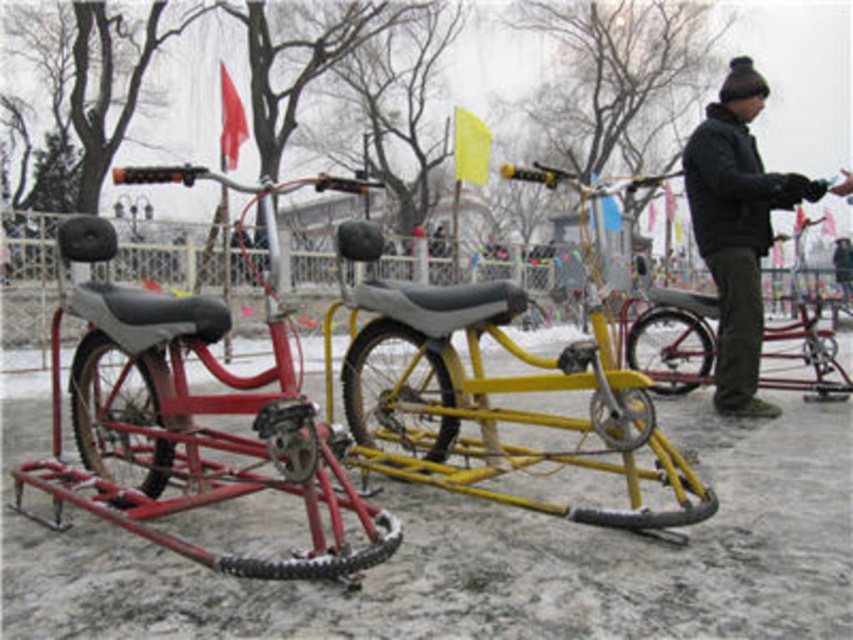
You are planning to ride a bicycle on the frozen lake and want to choose between the matte red bicycle at left and the yellow matte bicycle at center. Considering their sizes, which one might be easier to maneuver in tight spaces?

The matte red bicycle at left has a smaller size compared to the yellow matte bicycle at center, so it might be easier to maneuver in tight spaces due to its compact size.

From the picture: You are a winter explorer preparing to ride your snow bike on the frozen lake. You see the matte red bicycle at left and the black matte jacket at upper right. Which object is positioned lower in the image?

The matte red bicycle at left is positioned below the black matte jacket at upper right, so the matte red bicycle at left is lower in the image.

You are a delivery person who needs to choose between the matte red bicycle at left and the black matte jacket at upper right for a snowy delivery route. Which item is more suitable for carrying heavy packages?

The matte red bicycle at left is bigger than the black matte jacket at upper right, making it more suitable for carrying heavy packages.